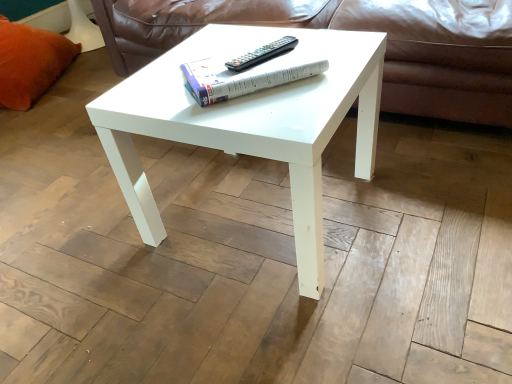
The height and width of the screenshot is (384, 512). Describe the element at coordinates (250, 123) in the screenshot. I see `white glossy coffee table at center` at that location.

Describe the element at coordinates (262, 54) in the screenshot. This screenshot has height=384, width=512. I see `black plastic remote at center` at that location.

The image size is (512, 384). I want to click on orange plush pillow at left, so point(30,62).

The height and width of the screenshot is (384, 512). Describe the element at coordinates (242, 78) in the screenshot. I see `white paper at center` at that location.

The image size is (512, 384). What do you see at coordinates (357, 30) in the screenshot? I see `leather at center` at bounding box center [357, 30].

This screenshot has height=384, width=512. Identify the location of white glossy coffee table at center. (250, 123).

Considering their positions, is black plastic remote at center located in front of or behind white glossy coffee table at center?

black plastic remote at center is behind white glossy coffee table at center.

How different are the orientations of black plastic remote at center and white glossy coffee table at center in degrees?

The facing directions of black plastic remote at center and white glossy coffee table at center are 67.2 degrees apart.

Based on their positions, is black plastic remote at center located to the left or right of white glossy coffee table at center?

In the image, black plastic remote at center appears on the right side of white glossy coffee table at center.

Consider the image. Measure the distance between black plastic remote at center and white glossy coffee table at center.

The distance of black plastic remote at center from white glossy coffee table at center is 9.50 inches.

Between point (224, 76) and point (42, 48), which one is positioned behind?

The point (42, 48) is farther.

Where is `paperback book that is on the right side of orange plush pillow at left`? The image size is (512, 384). paperback book that is on the right side of orange plush pillow at left is located at coordinates (242, 78).

Is white paper at center positioned far away from orange plush pillow at left?

white paper at center is far away from orange plush pillow at left.

Is white glossy coffee table at center turned away from orange plush pillow at left?

Yes, white glossy coffee table at center is facing away from orange plush pillow at left.

From the image's perspective, does white glossy coffee table at center appear lower than orange plush pillow at left?

Indeed, from the image's perspective, white glossy coffee table at center is shown beneath orange plush pillow at left.

Find the location of a particular element. The height and width of the screenshot is (384, 512). pillow behind the white glossy coffee table at center is located at coordinates (30, 62).

From a real-world perspective, is white glossy coffee table at center positioned over orange plush pillow at left based on gravity?

Incorrect, from a real-world perspective, white glossy coffee table at center is lower than orange plush pillow at left.

From the image's perspective, is leather at center beneath orange plush pillow at left?

Yes.

In the scene shown: Does leather at center have a smaller size compared to orange plush pillow at left?

Actually, leather at center might be larger than orange plush pillow at left.

Where is `couch above the orange plush pillow at left (from a real-world perspective)`? couch above the orange plush pillow at left (from a real-world perspective) is located at coordinates (357, 30).

Could you tell me if leather at center is facing orange plush pillow at left?

No, leather at center is not aimed at orange plush pillow at left.

Which object is thinner, white glossy coffee table at center or white paper at center?

white paper at center is thinner.

Is white glossy coffee table at center shorter than white paper at center?

Incorrect, the height of white glossy coffee table at center does not fall short of that of white paper at center.

From a real-world perspective, between white glossy coffee table at center and white paper at center, who is vertically lower?

white glossy coffee table at center.

From the image's perspective, is white glossy coffee table at center on top of white paper at center?

Actually, white glossy coffee table at center appears below white paper at center in the image.

Is white paper at center in contact with leather at center?

No, white paper at center is not beside leather at center.

In the scene shown: Is white paper at center oriented away from leather at center?

No, white paper at center's orientation is not away from leather at center.

Is white paper at center smaller than leather at center?

Yes.

Do you think white paper at center is within leather at center, or outside of it?

The correct answer is: outside.

Does black plastic remote at center touch white paper at center?

Yes.

Is black plastic remote at center at the left side of white paper at center?

No, black plastic remote at center is not to the left of white paper at center.

Which object is more forward, black plastic remote at center or white paper at center?

Positioned in front is white paper at center.

Between black plastic remote at center and white paper at center, which one has larger width?

Wider between the two is white paper at center.

Where is `coffee table beneath the black plastic remote at center (from a real-world perspective)`? This screenshot has height=384, width=512. coffee table beneath the black plastic remote at center (from a real-world perspective) is located at coordinates (250, 123).

At what (x,y) coordinates should I click in order to perform the action: click on pillow on the left side of white paper at center. Please return your answer as a coordinate pair (x, y). The width and height of the screenshot is (512, 384). Looking at the image, I should click on (30, 62).

Estimate the real-world distances between objects in this image. Which object is closer to leather at center, black plastic remote at center or white glossy coffee table at center?

white glossy coffee table at center.

Estimate the real-world distances between objects in this image. Which object is closer to white paper at center, leather at center or orange plush pillow at left?

leather at center.

Looking at the image, which one is located further to white glossy coffee table at center, black plastic remote at center or white paper at center?

Based on the image, black plastic remote at center appears to be further to white glossy coffee table at center.

Estimate the real-world distances between objects in this image. Which object is closer to orange plush pillow at left, leather at center or black plastic remote at center?

leather at center lies closer to orange plush pillow at left than the other object.

Which object lies further to the anchor point black plastic remote at center, orange plush pillow at left or white glossy coffee table at center?

orange plush pillow at left lies further to black plastic remote at center than the other object.

Considering their positions, is leather at center positioned further to white glossy coffee table at center than black plastic remote at center?

Based on the image, leather at center appears to be further to white glossy coffee table at center.

From the image, which object appears to be nearer to white glossy coffee table at center, orange plush pillow at left or leather at center?

The object closer to white glossy coffee table at center is leather at center.

From the image, which object appears to be nearer to white paper at center, orange plush pillow at left or black plastic remote at center?

black plastic remote at center lies closer to white paper at center than the other object.

The width and height of the screenshot is (512, 384). Identify the location of remote that lies between leather at center and white paper at center from top to bottom. (262, 54).

Locate an element on the screen. Image resolution: width=512 pixels, height=384 pixels. paperback book located between orange plush pillow at left and white glossy coffee table at center in the left-right direction is located at coordinates (242, 78).

Where is `paperback book between leather at center and white glossy coffee table at center from top to bottom`? paperback book between leather at center and white glossy coffee table at center from top to bottom is located at coordinates (242, 78).

You are a GUI agent. You are given a task and a screenshot of the screen. Output one action in this format:
    pyautogui.click(x=<x>, y=<y>)
    Task: Click on the paperback book between white glossy coffee table at center and black plastic remote at center along the z-axis
    This screenshot has width=512, height=384.
    Given the screenshot: What is the action you would take?
    pyautogui.click(x=242, y=78)